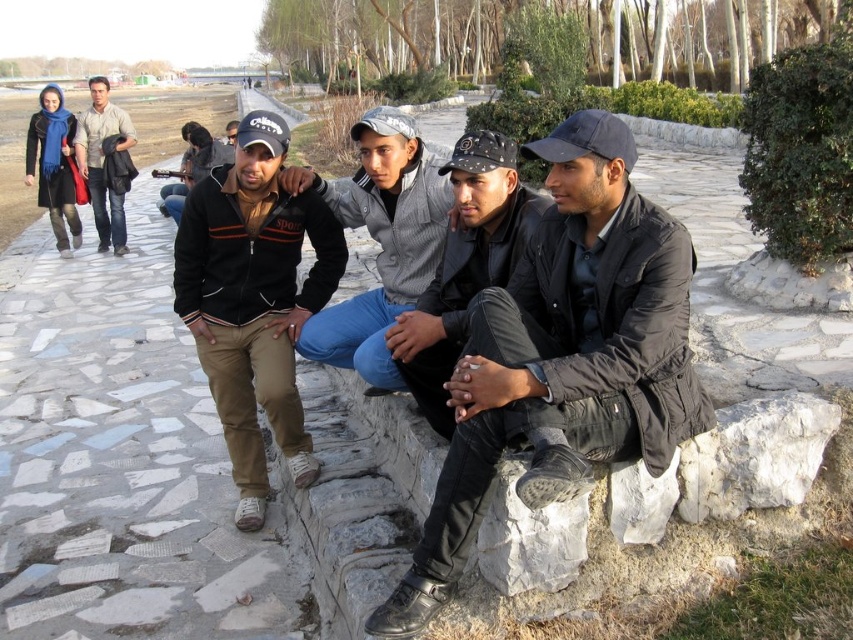
You are a fashion designer analyzing the clothing in the image. Which clothing item has a narrower width between the gray knit sweater at center and the matte beige jacket at upper left?

The gray knit sweater at center is thinner than the matte beige jacket at upper left, so the gray knit sweater at center has a narrower width.

You are a photographer standing at the scene. You want to take a photo of the matte beige jacket at upper left and the gray knit sweater at center. The minimum distance your camera can focus on two objects is 10 meters. Will both objects be in focus?

The gray knit sweater at center is 9.42 meters from matte beige jacket at upper left. Since the distance between them is less than 10 meters, the camera cannot focus on both objects simultaneously. Therefore, both objects will not be in focus.